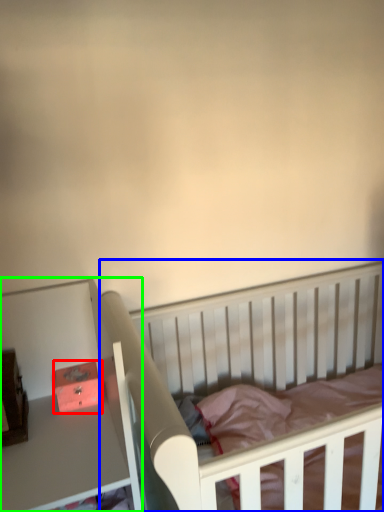
Question: Based on their relative distances, which object is farther from box (highlighted by a red box)? Choose from infant bed (highlighted by a blue box) and table (highlighted by a green box).

Choices:
 (A) infant bed
 (B) table

Answer: (A)